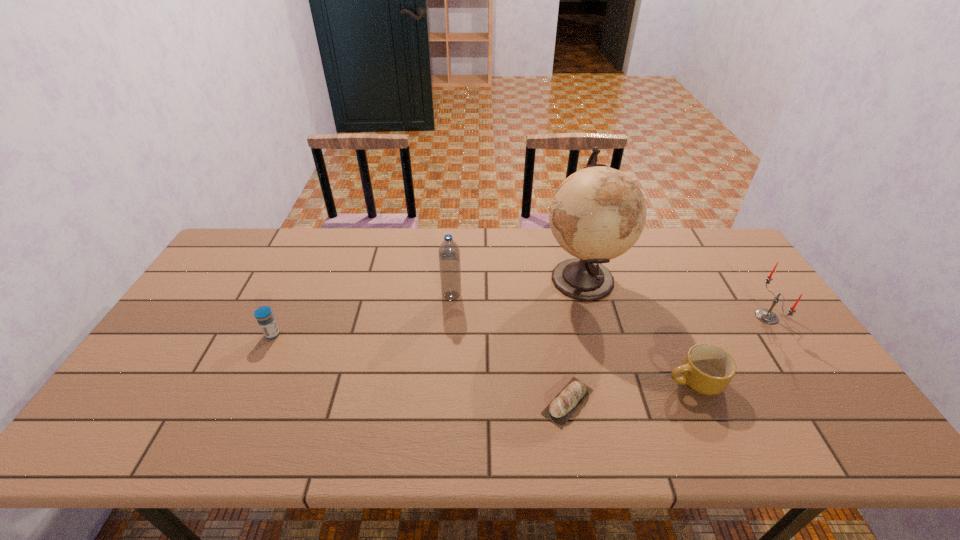
The width and height of the screenshot is (960, 540). Identify the location of unoccupied position between the leftmost object and the fifth object from right to left. (362, 315).

You are a GUI agent. You are given a task and a screenshot of the screen. Output one action in this format:
    pyautogui.click(x=<x>, y=<y>)
    Task: Click on the free area in between the medicine and the third tallest object
    The height and width of the screenshot is (540, 960).
    Given the screenshot: What is the action you would take?
    pyautogui.click(x=519, y=326)

Locate an element on the screen. vacant area that lies between the fifth object from right to left and the tallest object is located at coordinates (516, 287).

This screenshot has height=540, width=960. I want to click on free space that is in between the second tallest object and the shortest object, so click(x=510, y=349).

This screenshot has width=960, height=540. Identify the location of free spot between the medicine and the second object from left to right. (362, 315).

Find the location of a particular element. This screenshot has width=960, height=540. empty location between the pita bread and the medicine is located at coordinates (420, 368).

Where is `unoccupied position between the mug and the fourth shortest object`? unoccupied position between the mug and the fourth shortest object is located at coordinates (731, 349).

Locate which object is the closest to the fifth object from left to right. Please provide its 2D coordinates. Your answer should be formatted as a tuple, i.e. [(x, y)], where the tuple contains the x and y coordinates of a point satisfying the conditions above.

[(598, 213)]

Locate which object ranks fourth in proximity to the fourth shortest object. Please provide its 2D coordinates. Your answer should be formatted as a tuple, i.e. [(x, y)], where the tuple contains the x and y coordinates of a point satisfying the conditions above.

[(449, 254)]

The height and width of the screenshot is (540, 960). Find the location of `vacant region that satisfies the following two spatial constraints: 1. on the front-facing side of the globe; 2. on the side with the handle of the fifth object from left to right`. vacant region that satisfies the following two spatial constraints: 1. on the front-facing side of the globe; 2. on the side with the handle of the fifth object from left to right is located at coordinates (610, 382).